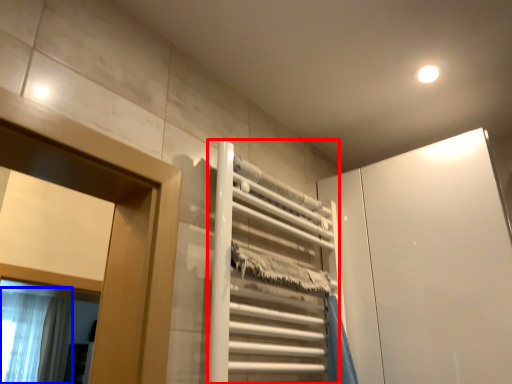
Question: Among these objects, which one is nearest to the camera, elevator (highlighted by a red box) or shower curtain (highlighted by a blue box)?

Choices:
 (A) elevator
 (B) shower curtain

Answer: (A)